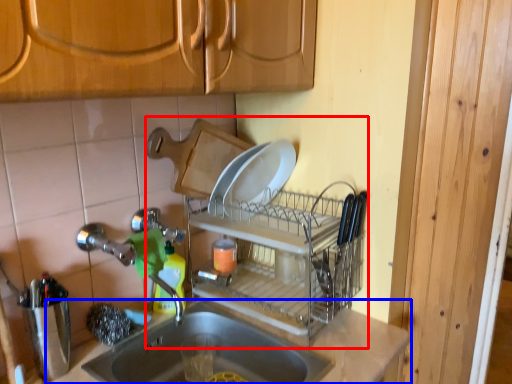
Question: Which object appears closest to the camera in this image, dish washer (highlighted by a red box) or countertop (highlighted by a blue box)?

Choices:
 (A) dish washer
 (B) countertop

Answer: (B)